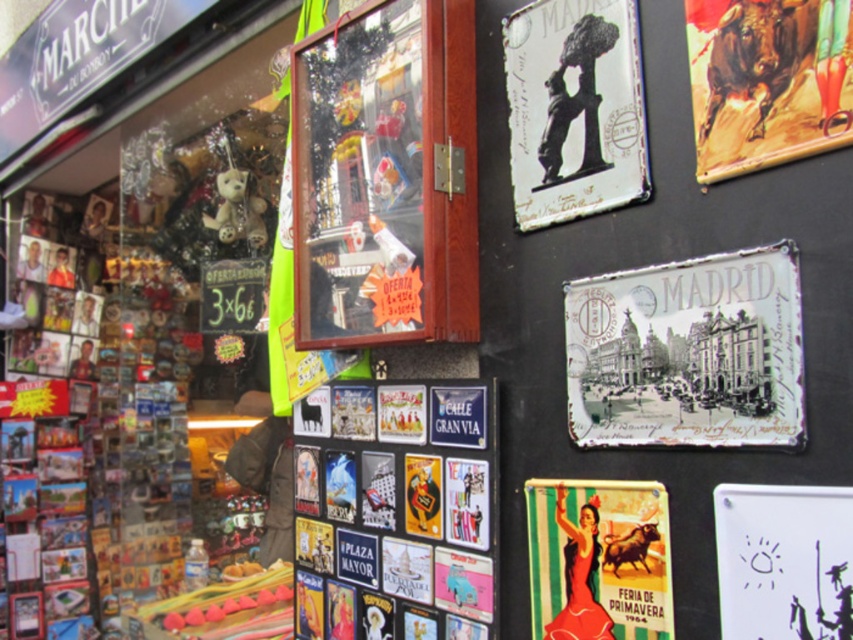
Looking at this image, can you confirm if metallic green and white poster at upper right is positioned below fuzzy white teddy bear at left?

Yes, metallic green and white poster at upper right is below fuzzy white teddy bear at left.

Who is lower down, metallic green and white poster at upper right or fuzzy white teddy bear at left?

metallic green and white poster at upper right is below.

What are the coordinates of `metallic green and white poster at upper right` in the screenshot? It's located at click(599, 560).

Identify the location of metallic green and white poster at upper right. This screenshot has height=640, width=853. coord(599,560).

Is metallic statue at upper center in front of metallic bull at upper right?

No, it is not.

Is point (587, 200) positioned behind point (815, 141)?

Yes, it is.

What are the coordinates of `metallic statue at upper center` in the screenshot? It's located at (573, 108).

Does white metal madrid sign at upper right lie in front of fuzzy white teddy bear at left?

Yes, white metal madrid sign at upper right is closer to the viewer.

Who is more distant from viewer, (589, 376) or (241, 205)?

Positioned behind is point (241, 205).

Identify the location of white metal madrid sign at upper right. (688, 353).